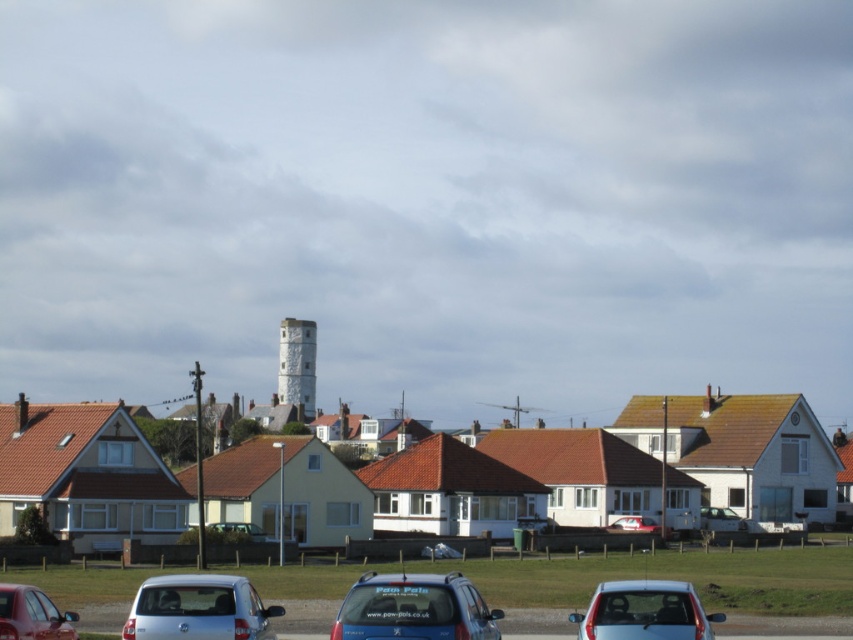
In the scene shown: You are a delivery person trying to park your delivery van in this residential area. You see the matte blue car at center and the white textured tower at center. Which object is more suitable for parking your van next to?

The white textured tower at center is more suitable for parking your van next to because the matte blue car at center is smaller and likely obstructed by the tower.